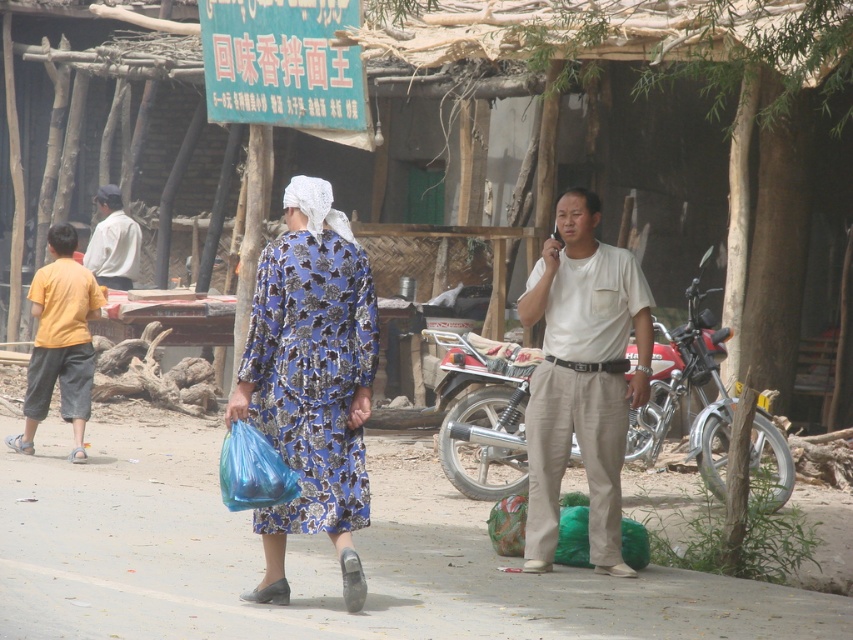
Question: Which of the following is the closest to the observer?

Choices:
 (A) light gray shirt at left
 (B) blue floral dress at center
 (C) white cotton shirt at center

Answer: (B)

Question: Does red matte motorcycle at center appear on the right side of light gray shirt at left?

Choices:
 (A) yes
 (B) no

Answer: (A)

Question: Does red matte motorcycle at center lie behind yellow cotton shirt at left?

Choices:
 (A) no
 (B) yes

Answer: (A)

Question: Does white cotton shirt at center appear over red matte motorcycle at center?

Choices:
 (A) yes
 (B) no

Answer: (A)

Question: Which point is closer to the camera?

Choices:
 (A) yellow cotton shirt at left
 (B) white cotton shirt at center

Answer: (B)

Question: Estimate the real-world distances between objects in this image. Which object is farther from the red matte motorcycle at center?

Choices:
 (A) blue floral dress at center
 (B) white cotton shirt at center
 (C) light gray shirt at left
 (D) yellow cotton shirt at left

Answer: (C)